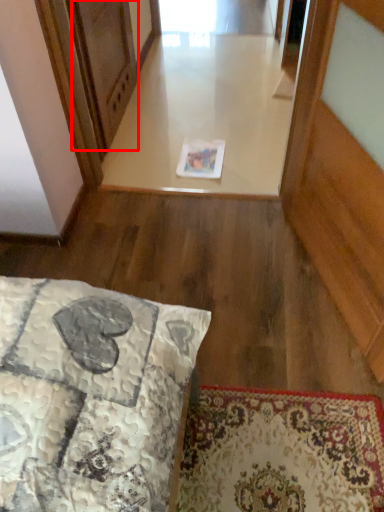
Question: In this image, where is screen door (annotated by the red box) located relative to window?

Choices:
 (A) right
 (B) left

Answer: (B)